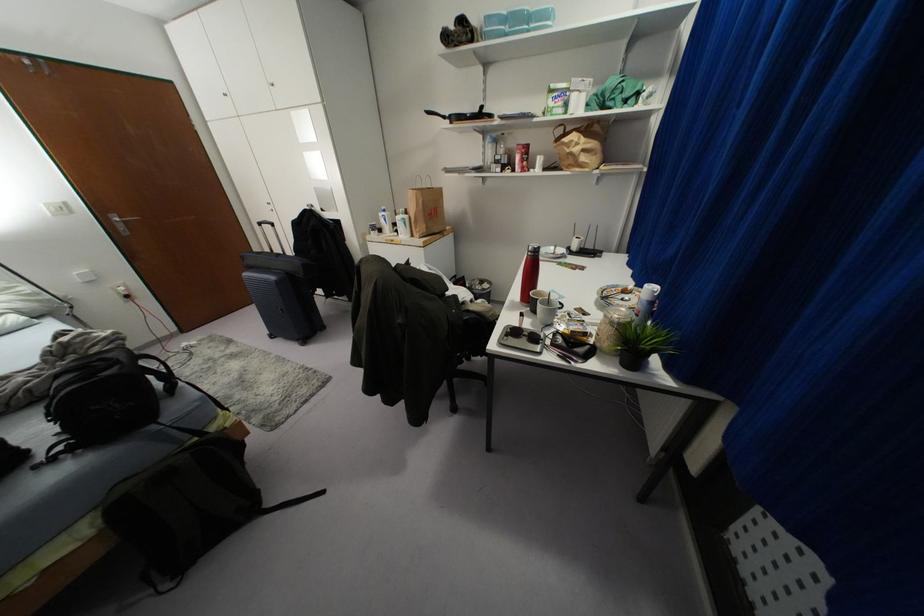
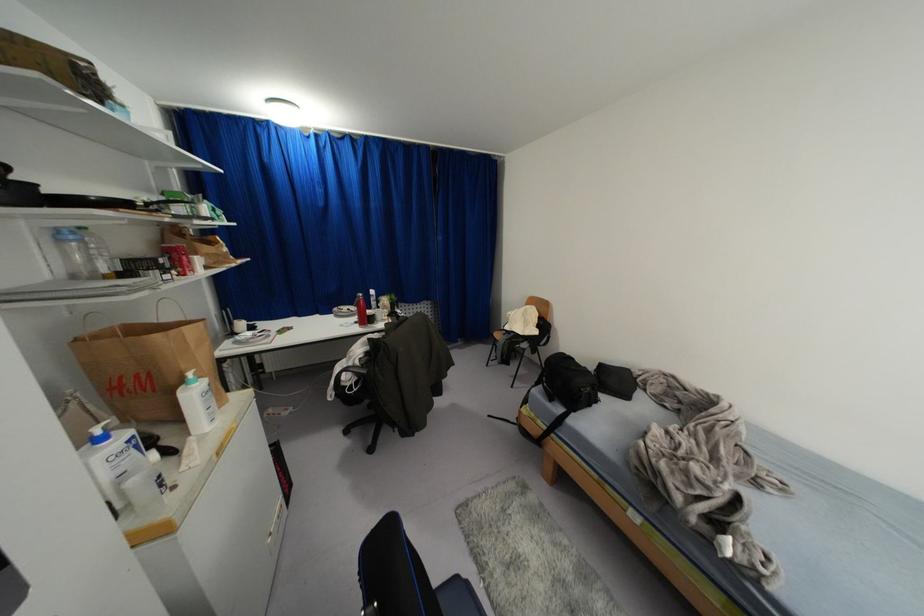
Where in the second image is the point corresponding to (x=568, y=246) from the first image?

(234, 333)